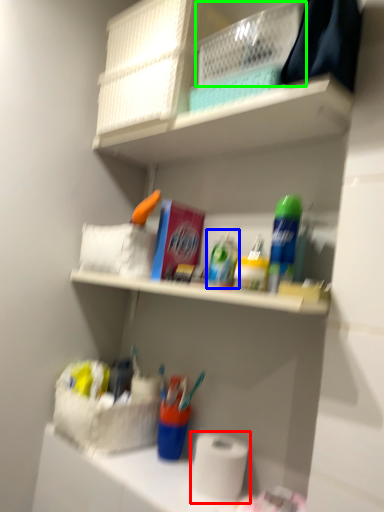
Question: Based on their relative distances, which object is nearer to toilet paper (highlighted by a red box)? Choose from toiletry (highlighted by a blue box) and basket (highlighted by a green box).

Choices:
 (A) toiletry
 (B) basket

Answer: (A)